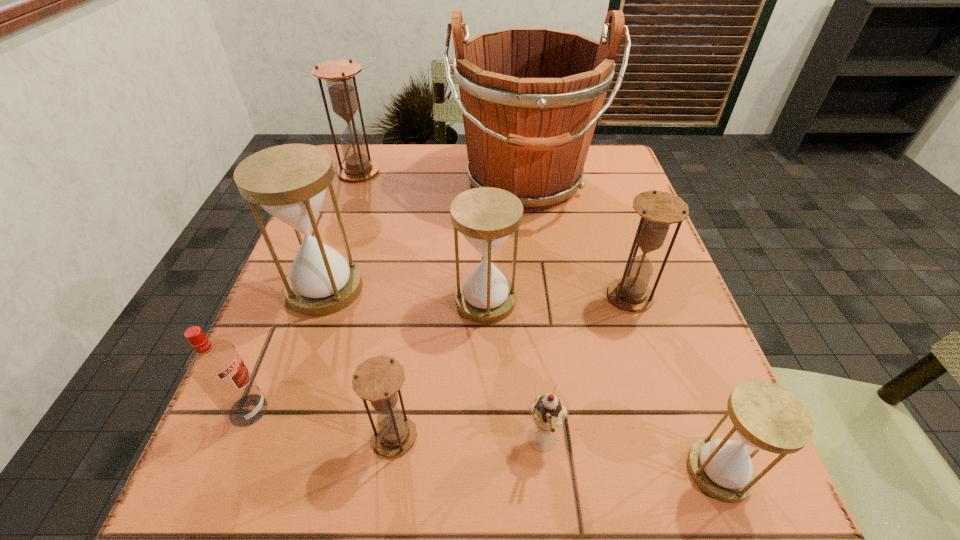
You are a GUI agent. You are given a task and a screenshot of the screen. Output one action in this format:
    pyautogui.click(x=<x>, y=<y>)
    Task: Click on the smallest brown hourglass
    
    Given the screenshot: What is the action you would take?
    pyautogui.click(x=377, y=379)

The height and width of the screenshot is (540, 960). In order to click on the smallest white hourglass in this screenshot , I will do `click(765, 416)`.

I want to click on the nearest white hourglass, so click(x=765, y=416).

Identify the location of the shortest object. (548, 412).

This screenshot has height=540, width=960. Identify the location of free space located 0.240m with the handle on the side of the tallest object. (540, 310).

Locate an element on the screen. The image size is (960, 540). free space located 0.080m on the back of the leftmost brown hourglass is located at coordinates (369, 146).

This screenshot has height=540, width=960. I want to click on vacant position located on the back of the leftmost white hourglass, so (355, 201).

Locate an element on the screen. blank space located on the front of the rightmost brown hourglass is located at coordinates (662, 396).

This screenshot has width=960, height=540. Identify the location of free space located 0.080m on the back of the second white hourglass from left to right. (485, 252).

At what (x,y) coordinates should I click in order to perform the action: click on free spot located 0.400m on the front label of the red vodka. Please return your answer as a coordinate pair (x, y). Looking at the image, I should click on (528, 410).